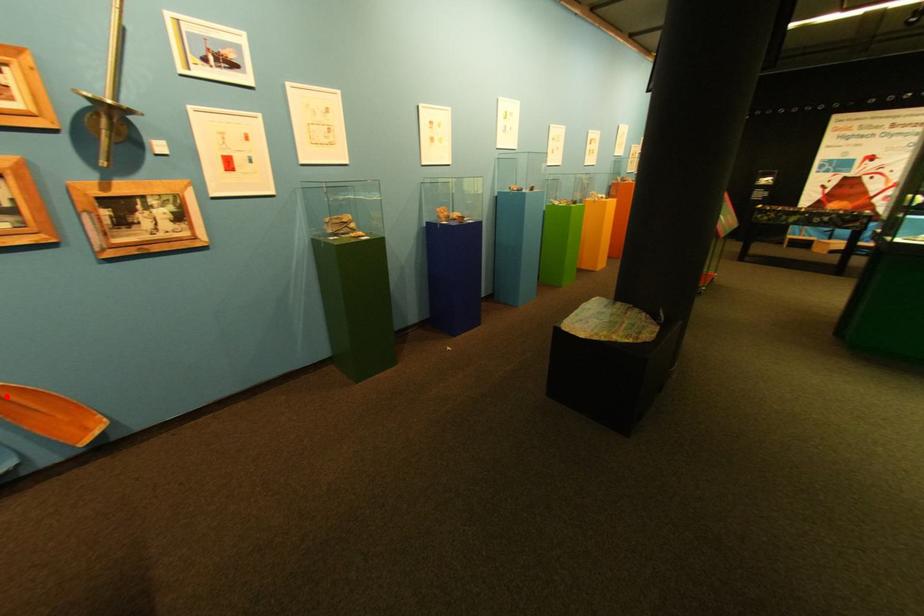
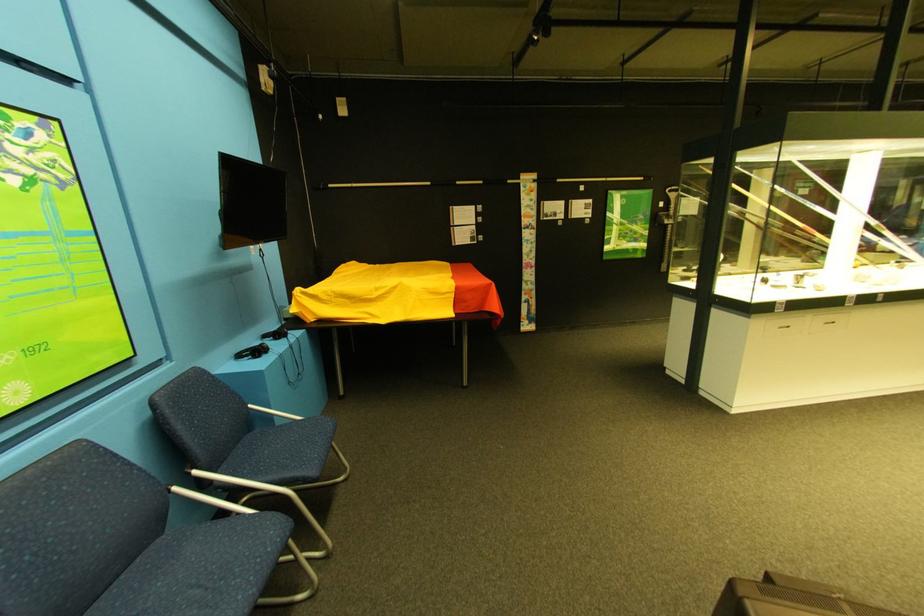
Question: I am providing you with two images of the same scene from different viewpoints. A red point is marked on the first image. At the location where the point appears in image 1, is it still visible in image 2?

Choices:
 (A) Yes
 (B) No

Answer: (B)